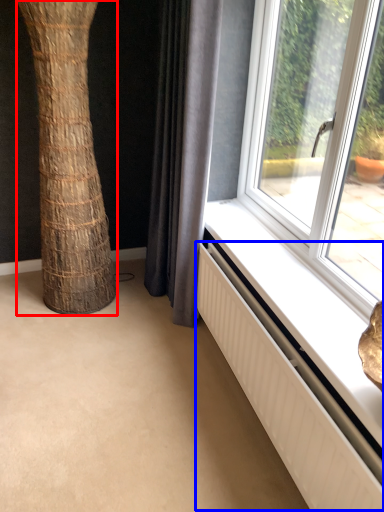
Question: Which point is closer to the camera, tree trunk (highlighted by a red box) or radiator (highlighted by a blue box)?

Choices:
 (A) tree trunk
 (B) radiator

Answer: (B)